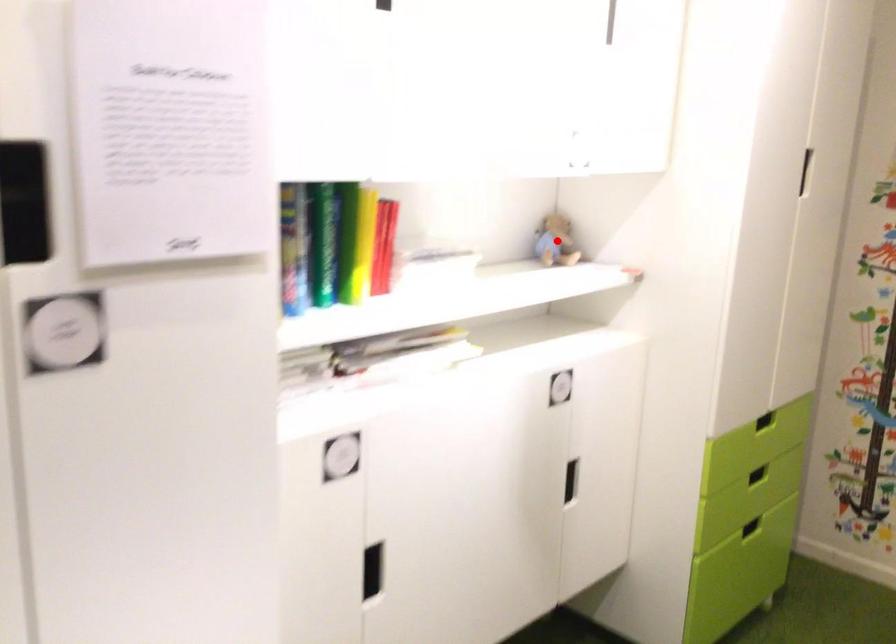
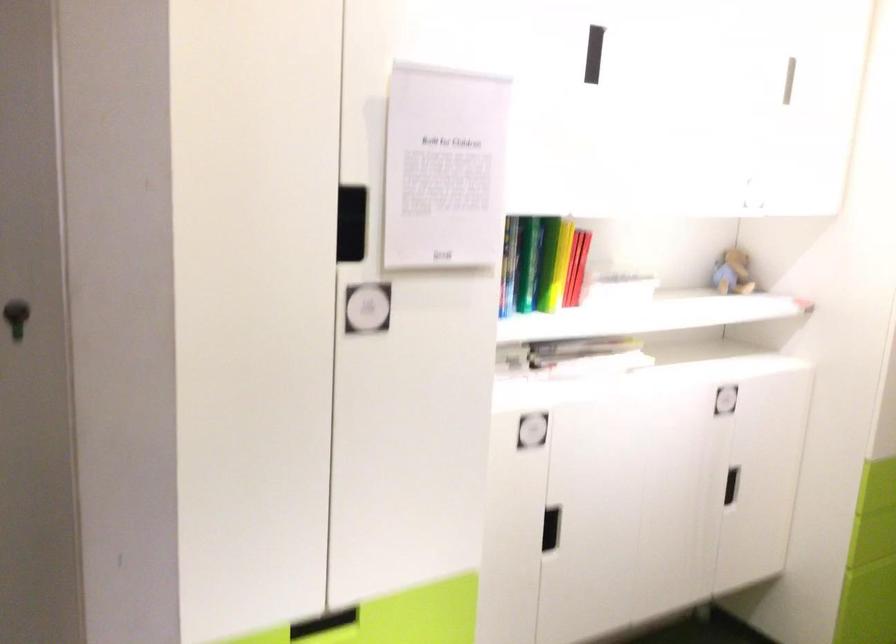
Question: A red point is marked in image1. In image2, is the corresponding 3D point closer to the camera or farther? Reply with the corresponding letter.

Choices:
 (A) The corresponding 3D point is closer.
 (B) The corresponding 3D point is farther.

Answer: (B)